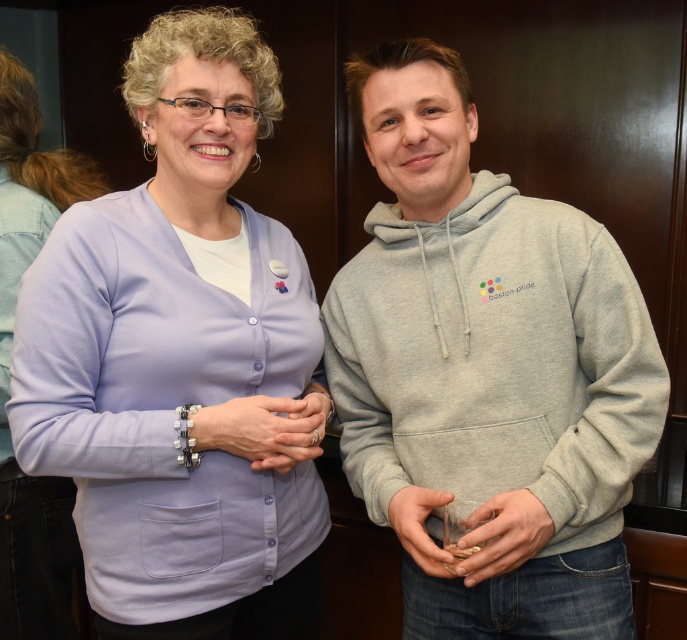
Question: Does matte purple cardigan at center have a smaller size compared to matte gray hoodie at center?

Choices:
 (A) yes
 (B) no

Answer: (B)

Question: Is lavender fabric cardigan at upper left to the right of matte gray phone at lower center from the viewer's perspective?

Choices:
 (A) yes
 (B) no

Answer: (B)

Question: Among these points, which one is nearest to the camera?

Choices:
 (A) (460, 173)
 (B) (281, 445)
 (C) (473, 580)
 (D) (431, 561)

Answer: (C)

Question: Can you confirm if gray heathered hoodie at center is thinner than matte silver ring at center?

Choices:
 (A) yes
 (B) no

Answer: (B)

Question: Which object is farther from the camera taking this photo?

Choices:
 (A) gray heathered hoodie at center
 (B) lavender fabric cardigan at upper left

Answer: (B)

Question: Which object appears farthest from the camera in this image?

Choices:
 (A) matte silver ring at center
 (B) gray heathered hoodie at center
 (C) lavender fabric cardigan at upper left

Answer: (A)